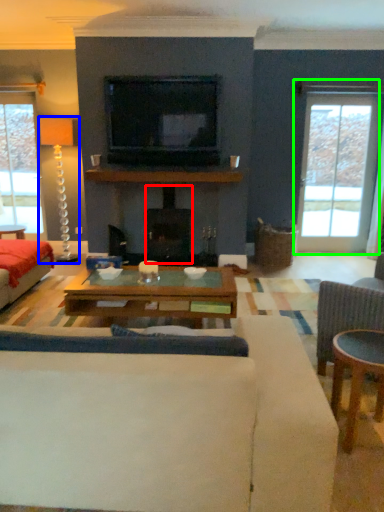
Question: Which object is the closest to the fireplace (highlighted by a red box)? Choose among these: lamp (highlighted by a blue box) or window (highlighted by a green box).

Choices:
 (A) lamp
 (B) window

Answer: (A)